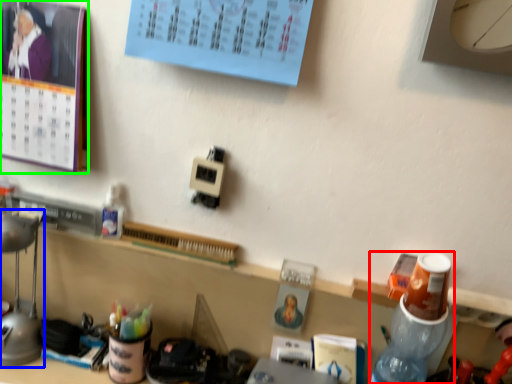
Question: Based on their relative distances, which object is farther from bottle (highlighted by a red box)? Choose from lamp (highlighted by a blue box) and bulletin board (highlighted by a green box).

Choices:
 (A) lamp
 (B) bulletin board

Answer: (A)